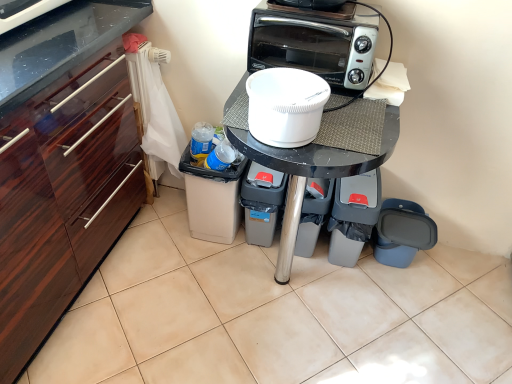
Image resolution: width=512 pixels, height=384 pixels. I want to click on vacant space to the left of blue plastic trash can at lower right, acting as the 1th appliance starting from the right, so click(x=349, y=283).